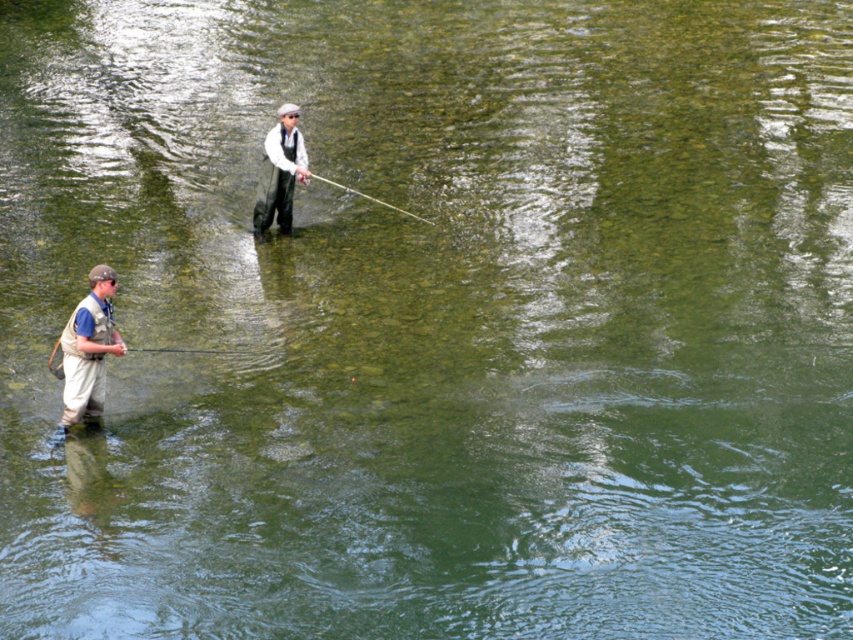
Question: Which is farther from the light brown fabric vest at lower left?

Choices:
 (A) white cotton shirt at center
 (B) smooth rod at center

Answer: (B)

Question: Which is farther from the light brown fabric vest at lower left?

Choices:
 (A) smooth rod at center
 (B) white cotton shirt at center

Answer: (A)

Question: Is light brown fabric vest at lower left to the right of smooth rod at center from the viewer's perspective?

Choices:
 (A) no
 (B) yes

Answer: (A)

Question: Considering the relative positions of white cotton shirt at center and smooth rod at center in the image provided, where is white cotton shirt at center located with respect to smooth rod at center?

Choices:
 (A) left
 (B) right

Answer: (A)

Question: Does white cotton shirt at center lie behind smooth rod at center?

Choices:
 (A) no
 (B) yes

Answer: (A)

Question: Which of the following is the farthest from the observer?

Choices:
 (A) (427, 220)
 (B) (84, 374)
 (C) (252, 220)

Answer: (C)